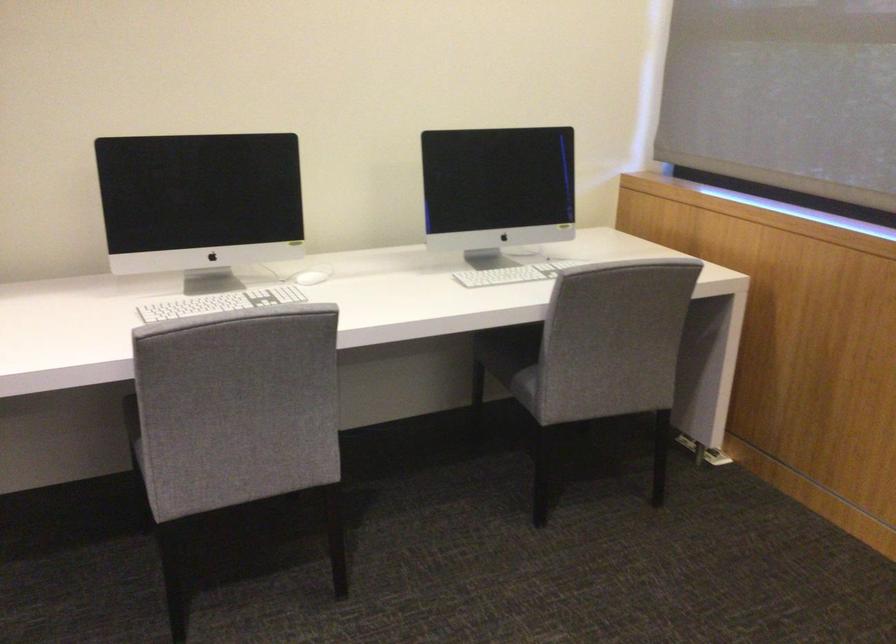
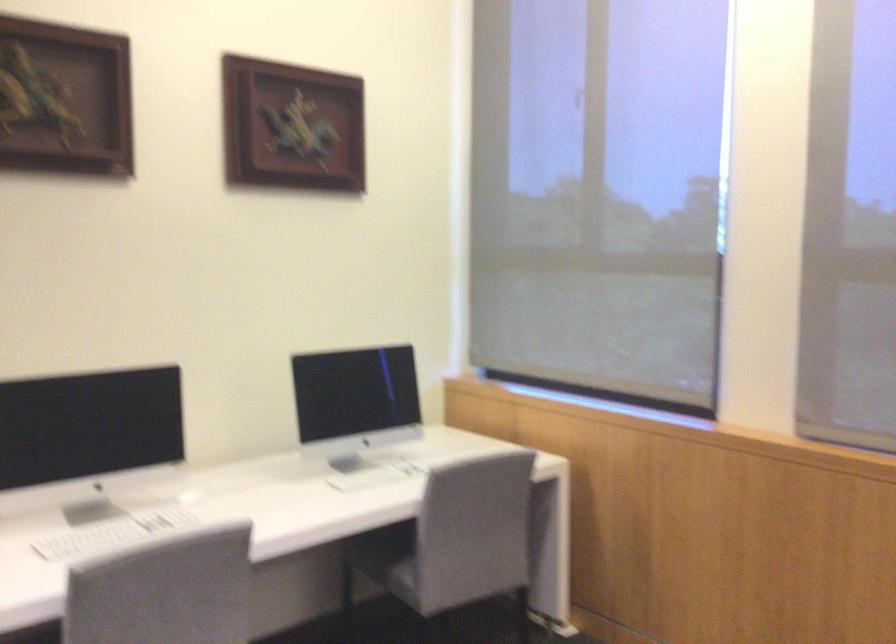
Question: The first image is from the beginning of the video and the second image is from the end. How did the camera likely rotate when shooting the video?

Choices:
 (A) Left
 (B) Right
 (C) Up
 (D) Down

Answer: (B)